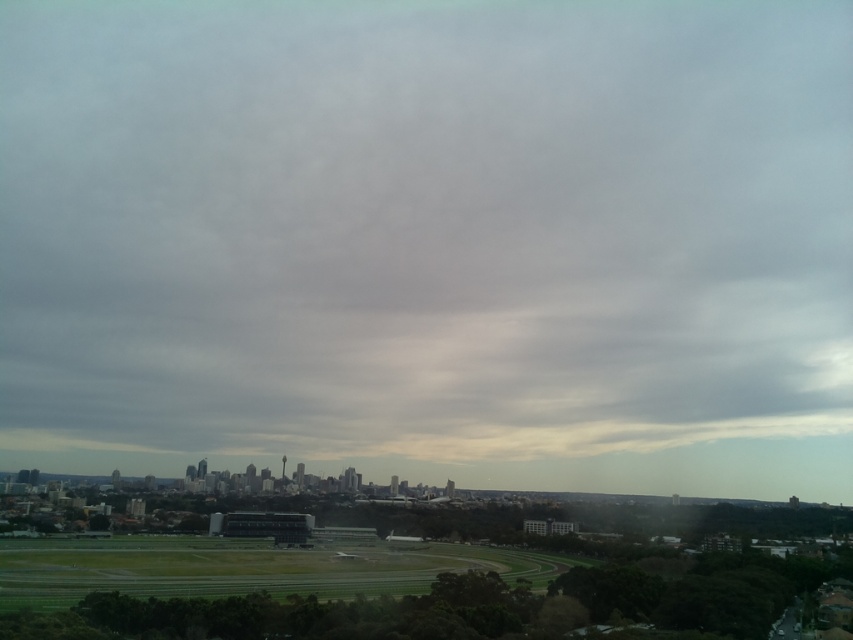
Is gray fluffy cloud at upper center taller than green grass football field at lower left?

Yes, gray fluffy cloud at upper center is taller than green grass football field at lower left.

The width and height of the screenshot is (853, 640). Describe the element at coordinates (422, 227) in the screenshot. I see `gray fluffy cloud at upper center` at that location.

Is point (674, 333) farther from camera compared to point (454, 564)?

Yes.

Identify the location of gray fluffy cloud at upper center. (422, 227).